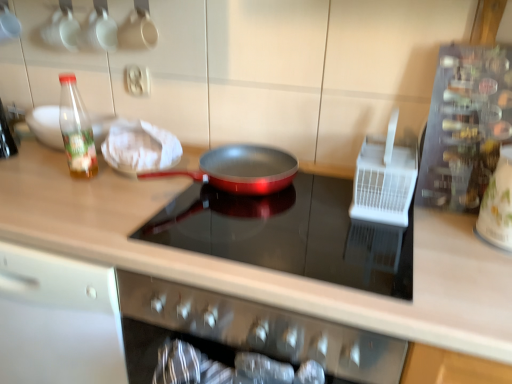
At what (x,y) coordinates should I click in order to perform the action: click on vacant area situated to the left side of white cloth at upper left. Please return your answer as a coordinate pair (x, y). Image resolution: width=512 pixels, height=384 pixels. Looking at the image, I should click on (62, 179).